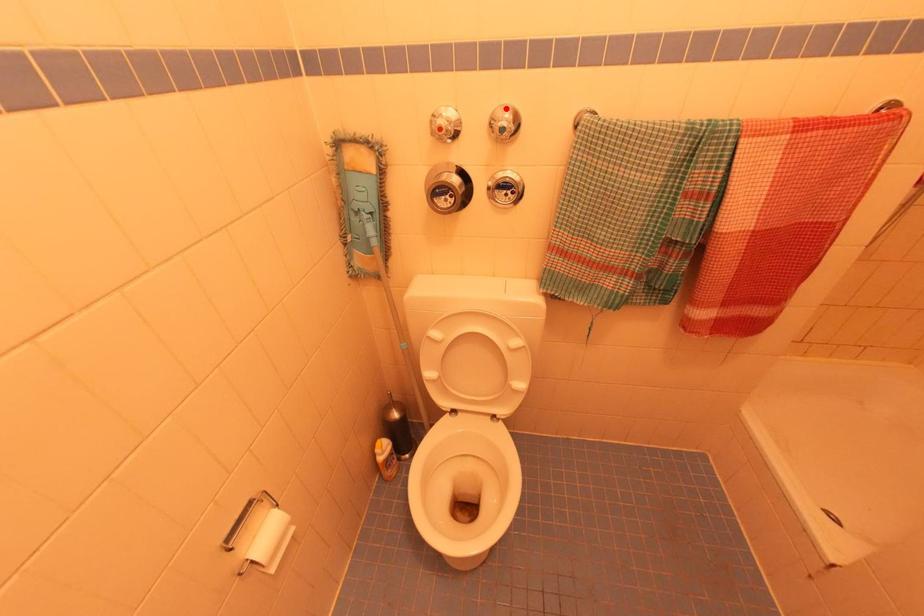
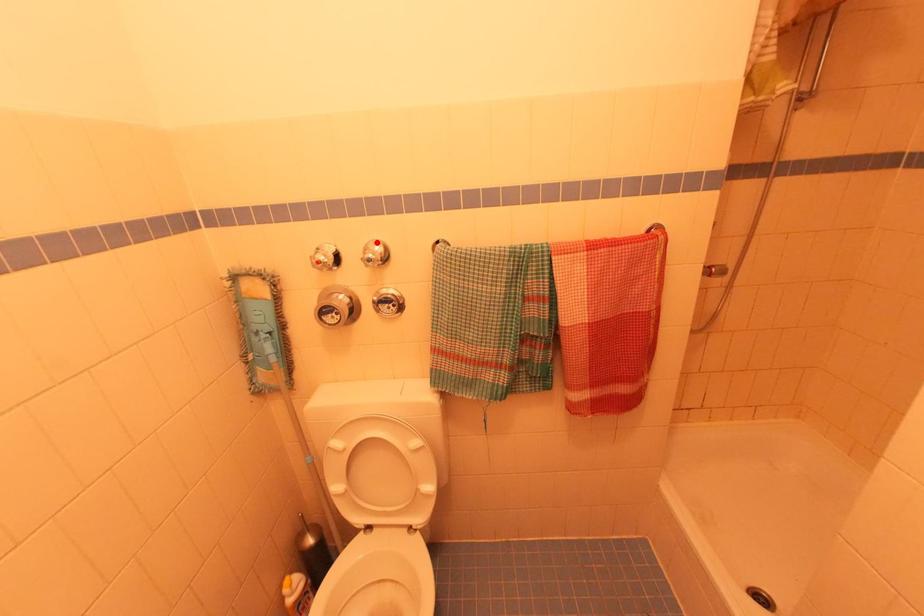
I am providing you with two images of the same scene from different viewpoints. A red point is marked on the first image and another point is marked on the second image. Are the points marked in image1 and image2 representing the same 3D position?

Yes